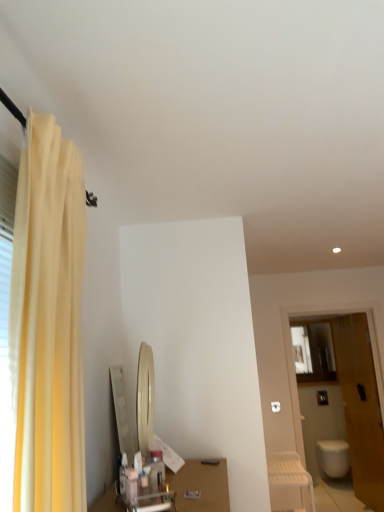
Question: From the image's perspective, is wooden door at right positioned above or below yellow fabric curtain at left?

Choices:
 (A) above
 (B) below

Answer: (B)

Question: Considering the relative positions of wooden door at right and yellow fabric curtain at left in the image provided, is wooden door at right to the left or to the right of yellow fabric curtain at left?

Choices:
 (A) left
 (B) right

Answer: (B)

Question: Which is farther from the white plastic chair at lower right?

Choices:
 (A) wooden door at right
 (B) matte glass medicine cabinet at right
 (C) white glossy toilet at lower right
 (D) yellow fabric curtain at left

Answer: (D)

Question: Which object is positioned closest to the white plastic chair at lower right?

Choices:
 (A) yellow fabric curtain at left
 (B) matte glass medicine cabinet at right
 (C) wooden door at right
 (D) white glossy toilet at lower right

Answer: (C)